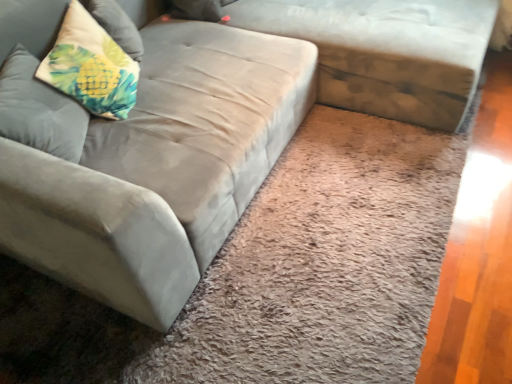
Question: Is suede gray couch at center shorter than fluffy fabric pillow at upper left, the 1th pillow ordered from the bottom?

Choices:
 (A) no
 (B) yes

Answer: (A)

Question: Can you confirm if suede gray couch at center is wider than fluffy fabric pillow at upper left, which is the second pillow from top to bottom?

Choices:
 (A) yes
 (B) no

Answer: (A)

Question: Considering the relative sizes of suede gray couch at center and fluffy fabric pillow at upper left, which is the second pillow from top to bottom, in the image provided, is suede gray couch at center smaller than fluffy fabric pillow at upper left, which is the second pillow from top to bottom,?

Choices:
 (A) no
 (B) yes

Answer: (A)

Question: Can you confirm if suede gray couch at center is positioned to the right of fluffy fabric pillow at upper left, which is the second pillow from top to bottom?

Choices:
 (A) yes
 (B) no

Answer: (A)

Question: Are suede gray couch at center and fluffy fabric pillow at upper left, the 1th pillow ordered from the bottom, beside each other?

Choices:
 (A) no
 (B) yes

Answer: (A)

Question: Is suede gray couch at center further to the viewer compared to fluffy fabric pillow at upper left, the 1th pillow ordered from the bottom?

Choices:
 (A) yes
 (B) no

Answer: (A)

Question: Does textured beige pillow at upper left, placed as the 2th pillow when sorted from bottom to top, appear on the left side of fluffy fabric pillow at upper left, the 1th pillow ordered from the bottom?

Choices:
 (A) no
 (B) yes

Answer: (A)

Question: Is textured beige pillow at upper left, placed as the 2th pillow when sorted from bottom to top, next to fluffy fabric pillow at upper left, which is the second pillow from top to bottom?

Choices:
 (A) no
 (B) yes

Answer: (A)

Question: Is textured beige pillow at upper left, placed as the 2th pillow when sorted from bottom to top, facing towards fluffy fabric pillow at upper left, the 1th pillow ordered from the bottom?

Choices:
 (A) yes
 (B) no

Answer: (B)

Question: Does textured beige pillow at upper left, the first pillow viewed from the top, appear on the right side of fluffy fabric pillow at upper left, the 1th pillow ordered from the bottom?

Choices:
 (A) no
 (B) yes

Answer: (B)

Question: From a real-world perspective, does textured beige pillow at upper left, placed as the 2th pillow when sorted from bottom to top, stand above fluffy fabric pillow at upper left, the 1th pillow ordered from the bottom?

Choices:
 (A) no
 (B) yes

Answer: (B)

Question: Is textured beige pillow at upper left, placed as the 2th pillow when sorted from bottom to top, oriented away from fluffy fabric pillow at upper left, the 1th pillow ordered from the bottom?

Choices:
 (A) no
 (B) yes

Answer: (A)

Question: From a real-world perspective, is textured beige pillow at upper left, placed as the 2th pillow when sorted from bottom to top, physically below suede gray couch at center?

Choices:
 (A) yes
 (B) no

Answer: (B)